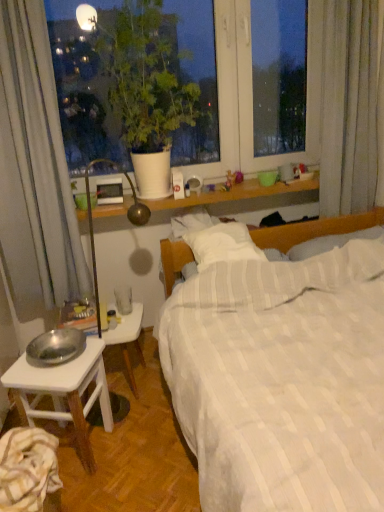
Where is `vacant area situated below metallic silver bowl at lower left (from a real-world perspective)`? This screenshot has height=512, width=384. vacant area situated below metallic silver bowl at lower left (from a real-world perspective) is located at coordinates (66, 359).